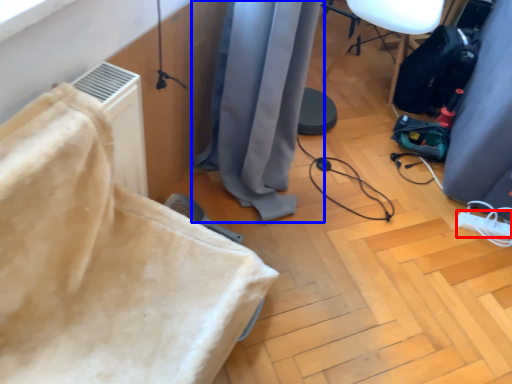
Question: Which object is further to the camera taking this photo, extension cord (highlighted by a red box) or curtain (highlighted by a blue box)?

Choices:
 (A) extension cord
 (B) curtain

Answer: (A)